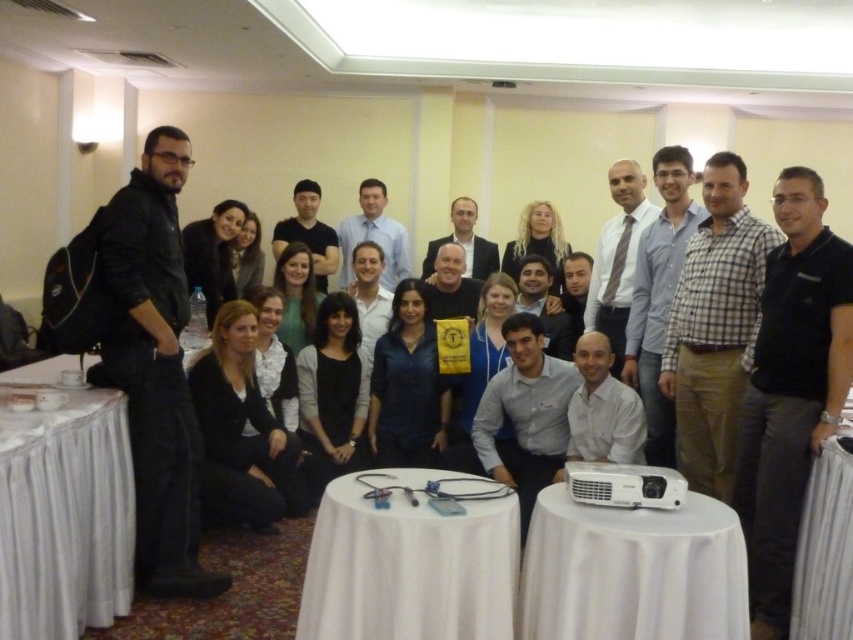
Question: Does black cotton polo shirt at center have a smaller size compared to white fabric tablecloth at lower left?

Choices:
 (A) yes
 (B) no

Answer: (A)

Question: Which object appears farthest from the camera in this image?

Choices:
 (A) white cloth-covered table at center
 (B) black leather jacket at left
 (C) black cotton polo shirt at center
 (D) white cloth at lower right

Answer: (B)

Question: Which point is farther to the camera?

Choices:
 (A) (84, 536)
 (B) (711, 497)
 (C) (492, 492)
 (D) (196, 449)

Answer: (D)

Question: Among these points, which one is farthest from the camera?

Choices:
 (A) (445, 616)
 (B) (845, 531)

Answer: (B)

Question: Is black leather jacket at left positioned before white fabric tablecloth at lower left?

Choices:
 (A) no
 (B) yes

Answer: (A)

Question: Can you confirm if black cotton polo shirt at center is positioned below white fabric tablecloth at lower left?

Choices:
 (A) no
 (B) yes

Answer: (A)